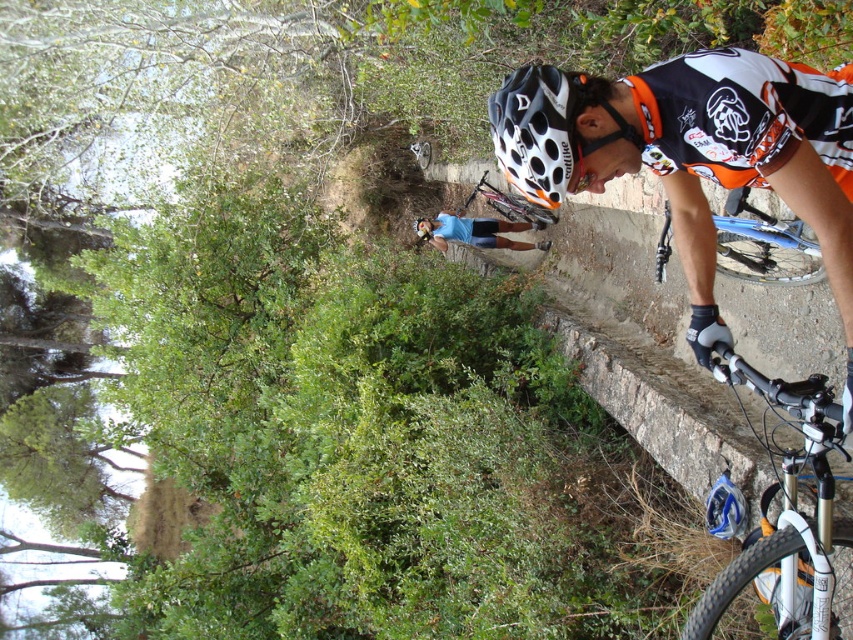
Between white dotted plastic helmet at center and matte black bicycle at center, which one appears on the left side from the viewer's perspective?

From the viewer's perspective, white dotted plastic helmet at center appears more on the left side.

Can you confirm if white dotted plastic helmet at center is bigger than matte black bicycle at center?

Incorrect, white dotted plastic helmet at center is not larger than matte black bicycle at center.

The height and width of the screenshot is (640, 853). What do you see at coordinates (537, 131) in the screenshot?
I see `white dotted plastic helmet at center` at bounding box center [537, 131].

Image resolution: width=853 pixels, height=640 pixels. I want to click on white dotted plastic helmet at center, so click(x=537, y=131).

Between blue metallic bicycle at right and matte black bicycle at center, which one is positioned lower?

blue metallic bicycle at right is below.

Which of these two, blue metallic bicycle at right or matte black bicycle at center, stands taller?

With more height is matte black bicycle at center.

Is point (733, 220) positioned in front of point (514, 212)?

Yes, point (733, 220) is in front of point (514, 212).

Locate an element on the screen. The image size is (853, 640). blue metallic bicycle at right is located at coordinates (764, 244).

Looking at this image, who is positioned more to the left, white matte bicycle at lower right or blue metallic bicycle at right?

white matte bicycle at lower right

Which of these two, white matte bicycle at lower right or blue metallic bicycle at right, stands shorter?

blue metallic bicycle at right is shorter.

Does point (845, 618) lie in front of point (764, 246)?

Yes, it is in front of point (764, 246).

Where is `white matte bicycle at lower right`? Image resolution: width=853 pixels, height=640 pixels. white matte bicycle at lower right is located at coordinates [x=785, y=531].